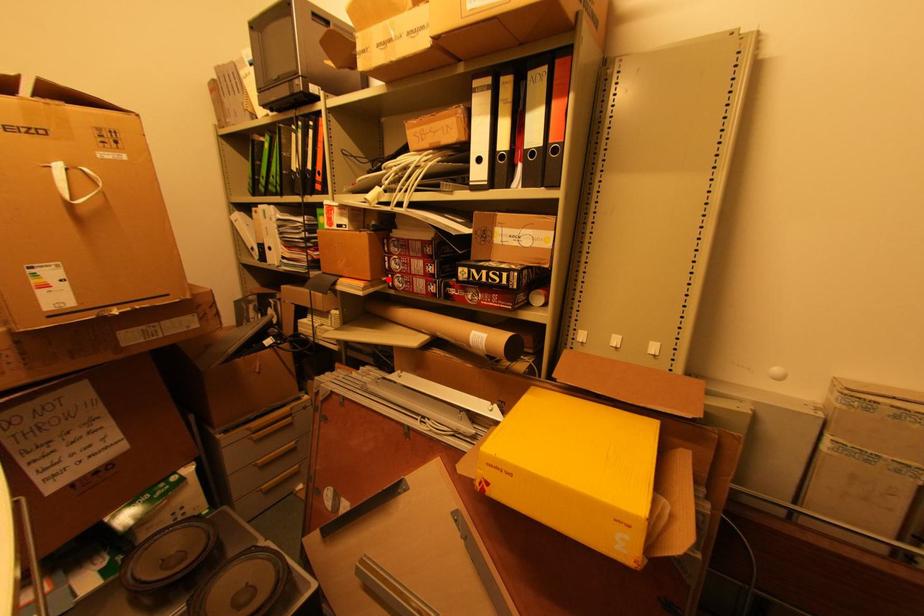
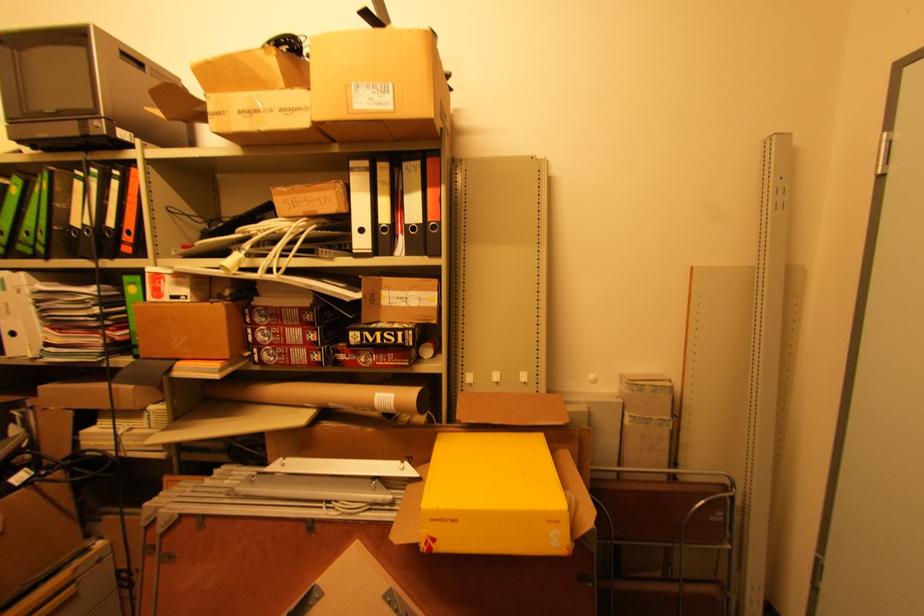
Find the pixel in the second image that matches the highlighted location in the first image.

(251, 354)